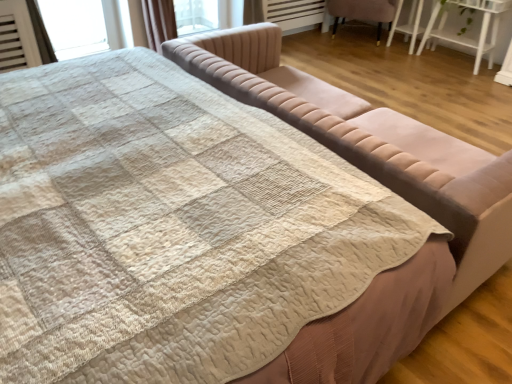
Question: Is velvet pink chair at upper right to the left of white glossy table at upper right from the viewer's perspective?

Choices:
 (A) yes
 (B) no

Answer: (A)

Question: Would you consider velvet pink chair at upper right to be distant from white glossy table at upper right?

Choices:
 (A) yes
 (B) no

Answer: (B)

Question: Is the position of velvet pink chair at upper right less distant than that of white glossy table at upper right?

Choices:
 (A) no
 (B) yes

Answer: (A)

Question: Is velvet pink chair at upper right to the right of white glossy table at upper right from the viewer's perspective?

Choices:
 (A) yes
 (B) no

Answer: (B)

Question: Can you see velvet pink chair at upper right touching white glossy table at upper right?

Choices:
 (A) no
 (B) yes

Answer: (A)

Question: Is white glossy table at upper right at the back of velvet pink chair at upper right?

Choices:
 (A) yes
 (B) no

Answer: (B)

Question: From the image's perspective, is velvet beige studio couch at center located above velvet pink chair at upper right?

Choices:
 (A) yes
 (B) no

Answer: (B)

Question: Is velvet beige studio couch at center to the right of velvet pink chair at upper right from the viewer's perspective?

Choices:
 (A) yes
 (B) no

Answer: (B)

Question: Can you confirm if velvet beige studio couch at center is taller than velvet pink chair at upper right?

Choices:
 (A) yes
 (B) no

Answer: (A)

Question: Is velvet beige studio couch at center outside velvet pink chair at upper right?

Choices:
 (A) yes
 (B) no

Answer: (A)

Question: From a real-world perspective, is velvet beige studio couch at center physically above velvet pink chair at upper right?

Choices:
 (A) no
 (B) yes

Answer: (B)

Question: Is velvet beige studio couch at center positioned behind velvet pink chair at upper right?

Choices:
 (A) yes
 (B) no

Answer: (B)

Question: Can you confirm if velvet beige studio couch at center is wider than white glossy table at upper right?

Choices:
 (A) no
 (B) yes

Answer: (B)